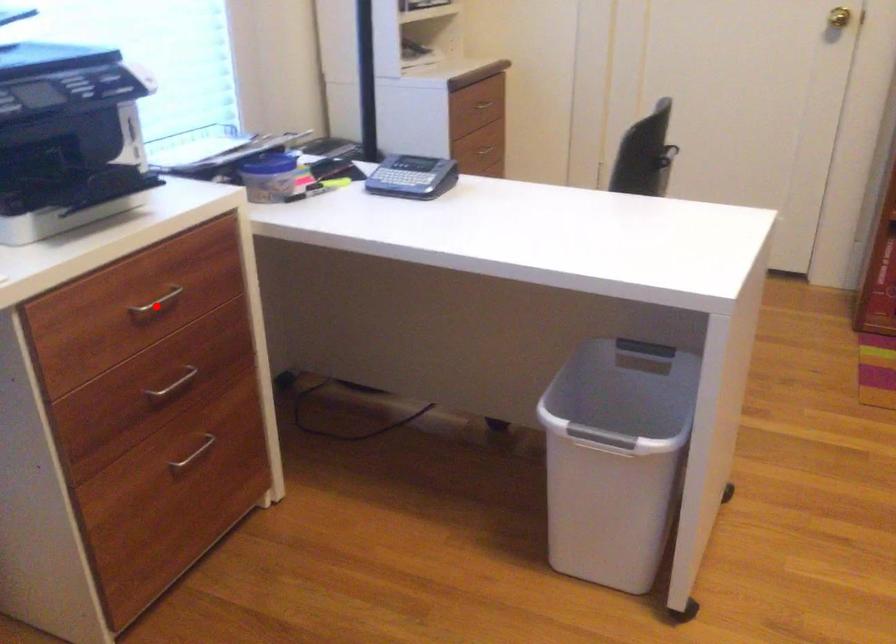
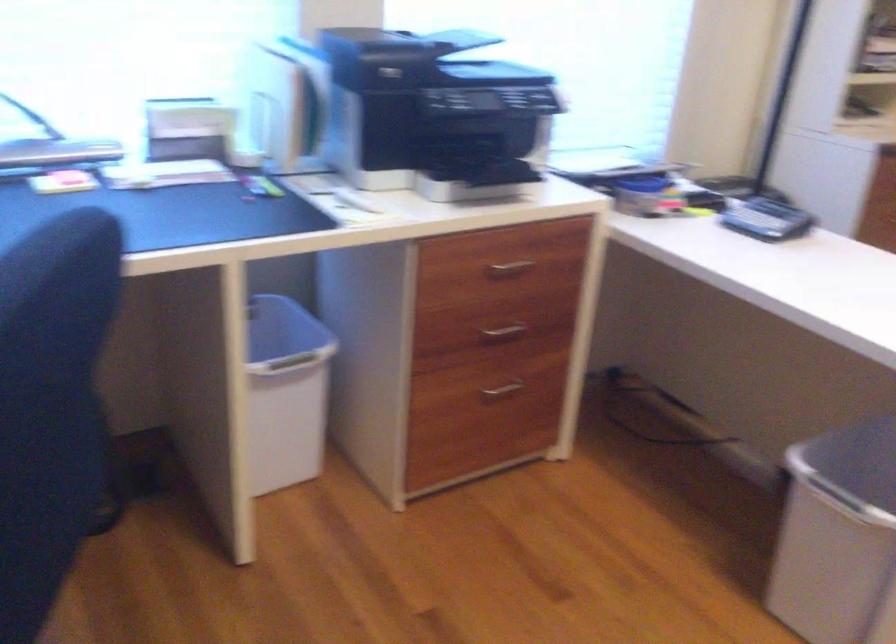
Locate, in the second image, the point that corresponds to the highlighted location in the first image.

(510, 268)